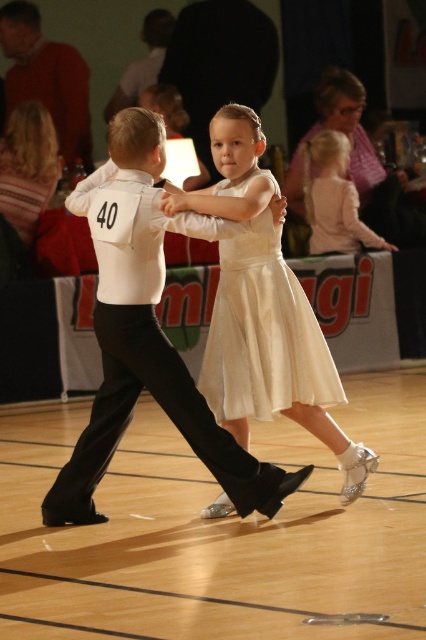
Question: Where is matte white shirt at center located in relation to white satin suit at center in the image?

Choices:
 (A) right
 (B) left

Answer: (B)

Question: Which object appears farthest from the camera in this image?

Choices:
 (A) red sweater at upper left
 (B) white satin suit at center
 (C) light pink fabric dress at upper right
 (D) white satin dress at center

Answer: (A)

Question: Among these points, which one is farthest from the camera?

Choices:
 (A) (267, 179)
 (B) (301, 477)
 (C) (75, 67)

Answer: (C)

Question: Observing the image, what is the correct spatial positioning of matte white shirt at center in reference to light pink fabric dress at upper right?

Choices:
 (A) above
 (B) below

Answer: (B)

Question: Which of the following is the farthest from the observer?

Choices:
 (A) (62, 122)
 (B) (344, 164)

Answer: (A)

Question: Is white satin dress at center thinner than red sweater at upper left?

Choices:
 (A) no
 (B) yes

Answer: (B)